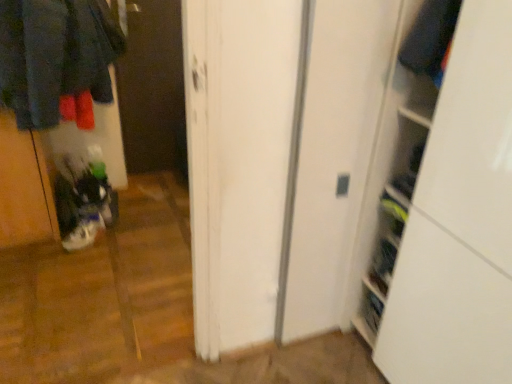
The width and height of the screenshot is (512, 384). What do you see at coordinates (153, 89) in the screenshot?
I see `dark wood screen door at center` at bounding box center [153, 89].

Image resolution: width=512 pixels, height=384 pixels. Find the location of `white matte sneakers at lower left`. white matte sneakers at lower left is located at coordinates (84, 228).

From their relative heights in the image, would you say velvet-like dark blue sweater at upper right is taller or shorter than white matte sneakers at lower left?

velvet-like dark blue sweater at upper right is taller than white matte sneakers at lower left.

Measure the distance from velvet-like dark blue sweater at upper right to white matte sneakers at lower left.

A distance of 1.92 meters exists between velvet-like dark blue sweater at upper right and white matte sneakers at lower left.

From the image's perspective, is velvet-like dark blue sweater at upper right below white matte sneakers at lower left?

No, from the image's perspective, velvet-like dark blue sweater at upper right is not beneath white matte sneakers at lower left.

From a real-world perspective, does velvet-like dark blue sweater at upper right stand above white matte sneakers at lower left?

Yes, from a real-world perspective, velvet-like dark blue sweater at upper right is on top of white matte sneakers at lower left.

From the picture: Which is in front, white matte sneakers at lower left or dark wood screen door at center?

white matte sneakers at lower left.

Is point (76, 225) less distant than point (168, 34)?

Yes.

Consider the image. Which of these two, white matte sneakers at lower left or dark wood screen door at center, stands shorter?

Standing shorter between the two is white matte sneakers at lower left.

Locate an element on the screen. The image size is (512, 384). screen door on the right of white matte sneakers at lower left is located at coordinates (153, 89).

Which is more to the right, dark wood screen door at center or velvet-like dark blue sweater at upper right?

velvet-like dark blue sweater at upper right is more to the right.

Does point (122, 136) lie in front of point (456, 15)?

That is False.

Where is `clothing lying below the dark wood screen door at center (from the image's perspective)`? The width and height of the screenshot is (512, 384). clothing lying below the dark wood screen door at center (from the image's perspective) is located at coordinates (430, 38).

From the image's perspective, does white matte sneakers at lower left appear higher than velvet-like dark blue sweater at upper right?

No, from the image's perspective, white matte sneakers at lower left is not over velvet-like dark blue sweater at upper right.

Is white matte sneakers at lower left taller or shorter than velvet-like dark blue sweater at upper right?

In the image, white matte sneakers at lower left appears to be shorter than velvet-like dark blue sweater at upper right.

Choose the correct answer: Is white matte sneakers at lower left inside velvet-like dark blue sweater at upper right or outside it?

white matte sneakers at lower left cannot be found inside velvet-like dark blue sweater at upper right.

Which point is more forward, (78, 231) or (440, 10)?

The point (440, 10) is more forward.

Is dark wood screen door at center positioned beyond the bounds of white matte sneakers at lower left?

Absolutely, dark wood screen door at center is external to white matte sneakers at lower left.

Does point (132, 71) lie behind point (74, 246)?

Yes, it is behind point (74, 246).

The width and height of the screenshot is (512, 384). I want to click on footwear that appears in front of the dark wood screen door at center, so click(84, 228).

Looking at this image, does dark wood screen door at center have a lesser width compared to white matte sneakers at lower left?

Yes, dark wood screen door at center is thinner than white matte sneakers at lower left.

Considering the positions of objects velvet-like dark blue sweater at upper right and dark wood screen door at center in the image provided, who is more to the left, velvet-like dark blue sweater at upper right or dark wood screen door at center?

From the viewer's perspective, dark wood screen door at center appears more on the left side.

Is velvet-like dark blue sweater at upper right facing towards dark wood screen door at center?

No.

Is velvet-like dark blue sweater at upper right closer to the viewer compared to dark wood screen door at center?

Yes, velvet-like dark blue sweater at upper right is in front of dark wood screen door at center.

Find the location of `footwear on the left of velvet-like dark blue sweater at upper right`. footwear on the left of velvet-like dark blue sweater at upper right is located at coordinates (84, 228).

This screenshot has height=384, width=512. Find the location of `screen door above the white matte sneakers at lower left (from a real-world perspective)`. screen door above the white matte sneakers at lower left (from a real-world perspective) is located at coordinates (153, 89).

Considering their positions, is velvet-like dark blue sweater at upper right positioned further to white matte sneakers at lower left than dark wood screen door at center?

velvet-like dark blue sweater at upper right lies further to white matte sneakers at lower left than the other object.

Based on their spatial positions, is dark wood screen door at center or white matte sneakers at lower left closer to velvet-like dark blue sweater at upper right?

Based on the image, white matte sneakers at lower left appears to be nearer to velvet-like dark blue sweater at upper right.

Which object lies further to the anchor point velvet-like dark blue sweater at upper right, white matte sneakers at lower left or dark wood screen door at center?

Based on the image, dark wood screen door at center appears to be further to velvet-like dark blue sweater at upper right.

Estimate the real-world distances between objects in this image. Which object is further from dark wood screen door at center, white matte sneakers at lower left or velvet-like dark blue sweater at upper right?

velvet-like dark blue sweater at upper right lies further to dark wood screen door at center than the other object.

Which object lies further to the anchor point dark wood screen door at center, velvet-like dark blue sweater at upper right or white matte sneakers at lower left?

velvet-like dark blue sweater at upper right is further to dark wood screen door at center.

Which object lies nearer to the anchor point white matte sneakers at lower left, dark wood screen door at center or velvet-like dark blue sweater at upper right?

dark wood screen door at center lies closer to white matte sneakers at lower left than the other object.

At what (x,y) coordinates should I click in order to perform the action: click on screen door located between white matte sneakers at lower left and velvet-like dark blue sweater at upper right in the left-right direction. Please return your answer as a coordinate pair (x, y). Looking at the image, I should click on (153, 89).